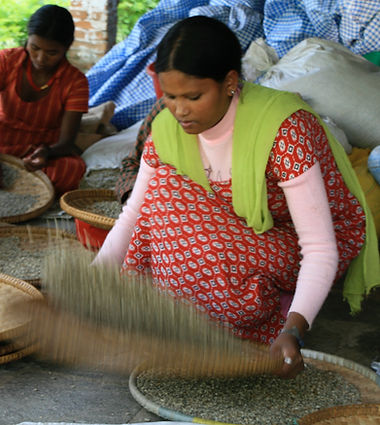
Where is `concrete floor`? The image size is (380, 425). concrete floor is located at coordinates (36, 393).